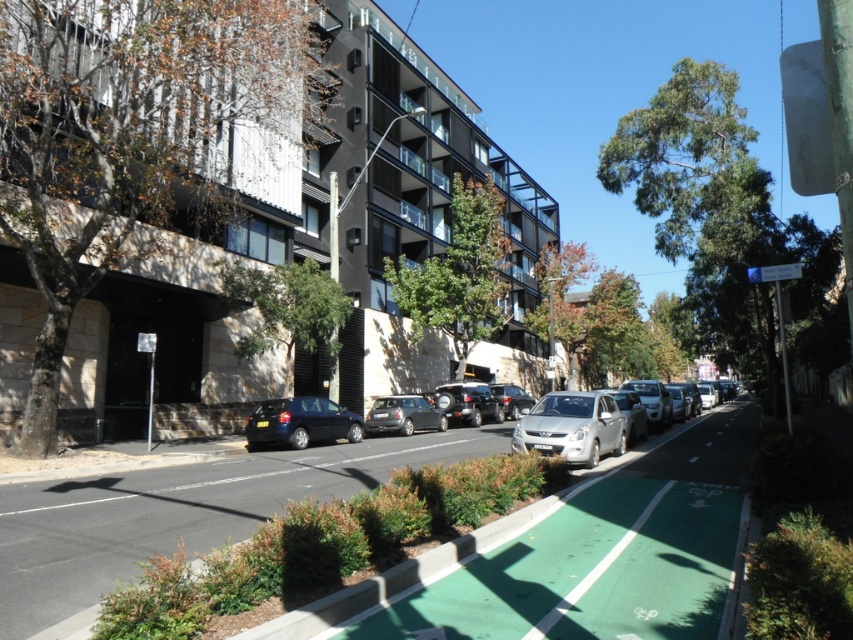
Is green rubber bike lane at lower right behind satin silver car at center?

No, green rubber bike lane at lower right is closer to the viewer.

Between point (204, 516) and point (392, 406), which one is positioned in front?

Positioned in front is point (204, 516).

The height and width of the screenshot is (640, 853). I want to click on green rubber bike lane at lower right, so click(178, 513).

Is green rubber bike lane at center smaller than green rubber bike lane at lower right?

Correct, green rubber bike lane at center occupies less space than green rubber bike lane at lower right.

Between point (668, 625) and point (59, 605), which one is positioned behind?

Point (59, 605)

Is point (468, 593) positioned behind point (215, 525)?

No, it is in front of (215, 525).

At what (x,y) coordinates should I click in order to perform the action: click on green rubber bike lane at center. Please return your answer as a coordinate pair (x, y). This screenshot has height=640, width=853. Looking at the image, I should click on coord(601,556).

Can you confirm if green rubber bike lane at center is positioned to the left of metallic silver sedan at center?

In fact, green rubber bike lane at center is to the right of metallic silver sedan at center.

At what (x,y) coordinates should I click in order to perform the action: click on green rubber bike lane at center. Please return your answer as a coordinate pair (x, y). The height and width of the screenshot is (640, 853). Looking at the image, I should click on (601, 556).